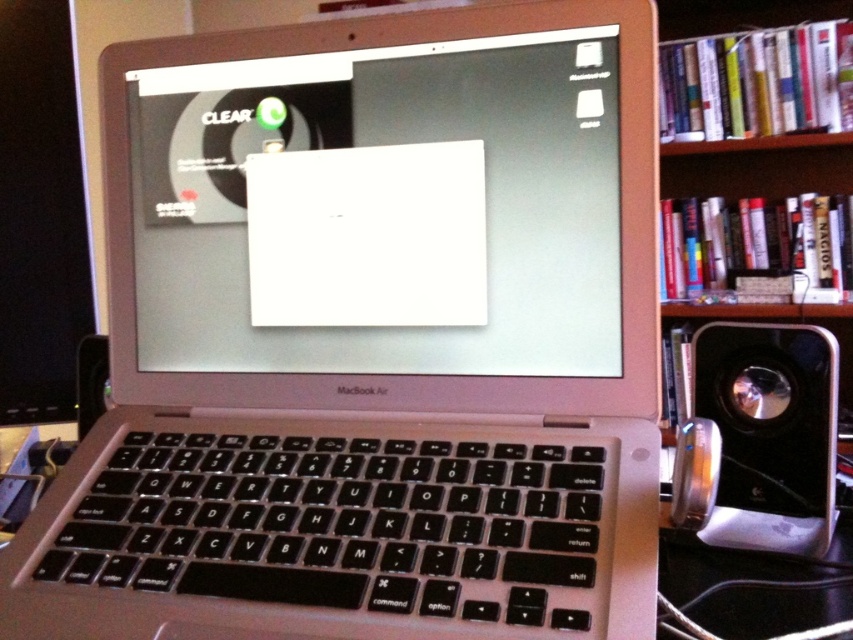
You are a photographer setting up a shot of the MacBook Air laptop. You want to focus on the white matte paper at center and the metallic silver speaker at lower left. Which object should you adjust your camera focus on first if you want to ensure both are in focus?

The white matte paper at center is closer to the viewer than the metallic silver speaker at lower left, so you should focus on the metallic silver speaker at lower left first to ensure both are in focus.

You are organizing a desk and need to place both the white matte paper at center and the wooden bookshelf at right. Which object has a smaller width and should be placed in a tighter space?

The white matte paper at center has a lesser width compared to the wooden bookshelf at right, so it should be placed in the tighter space.

Consider the image. You are holding a ruler and want to measure the distance from your eyes to the point on the MacBook Air screen labeled as point (210, 188). Based on the scene, what is this distance?

The distance of point (210, 188) from viewer is 19.54 inches.